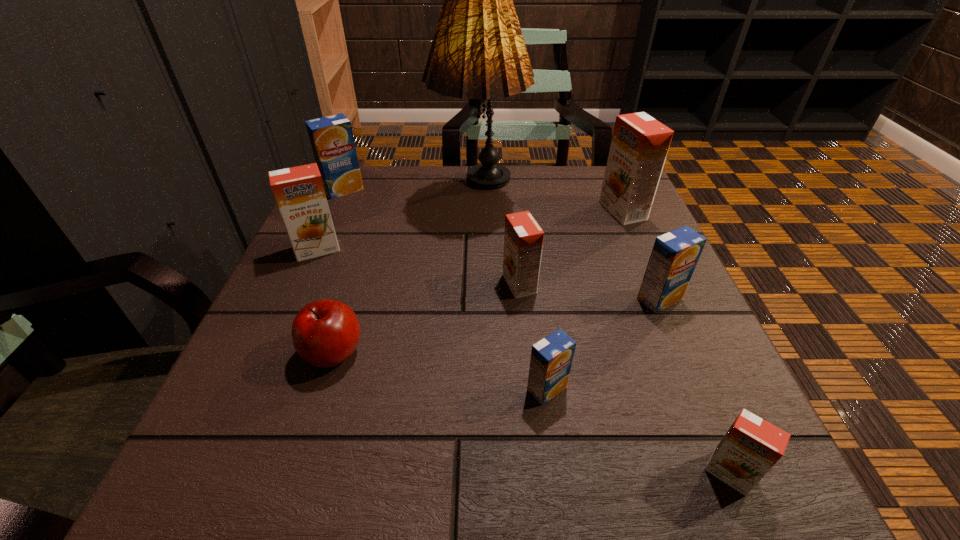
Locate an element on the screen. empty location between the third smallest orange orange juice and the sixth farthest orange juice is located at coordinates (432, 319).

Identify the location of vacant point located between the second orange orange juice from left to right and the second nearest orange juice. The image size is (960, 540). (533, 336).

In order to click on free area in between the third smallest orange orange juice and the nearest orange juice in this screenshot , I will do `click(523, 361)`.

This screenshot has width=960, height=540. Find the location of `vacant area between the rightmost blue orange_juice and the smallest blue orange_juice`. vacant area between the rightmost blue orange_juice and the smallest blue orange_juice is located at coordinates (603, 344).

The image size is (960, 540). In order to click on free area in between the lampshade and the farthest blue orange_juice in this screenshot , I will do `click(411, 192)`.

Find the location of `free spot between the nearest orange orange juice and the pink apple`. free spot between the nearest orange orange juice and the pink apple is located at coordinates (531, 413).

Find the location of `free spot between the nearest orange juice and the biggest blue orange_juice`. free spot between the nearest orange juice and the biggest blue orange_juice is located at coordinates (536, 332).

In order to click on object that stands as the seventh closest to the apple in this screenshot , I will do [x=751, y=447].

Locate which object ranks in proximity to the third farthest orange orange juice. Please provide its 2D coordinates. Your answer should be formatted as a tuple, i.e. [(x, y)], where the tuple contains the x and y coordinates of a point satisfying the conditions above.

[(478, 52)]

Where is `orange juice that is the sixth closest to the biggest blue orange_juice`? orange juice that is the sixth closest to the biggest blue orange_juice is located at coordinates (751, 447).